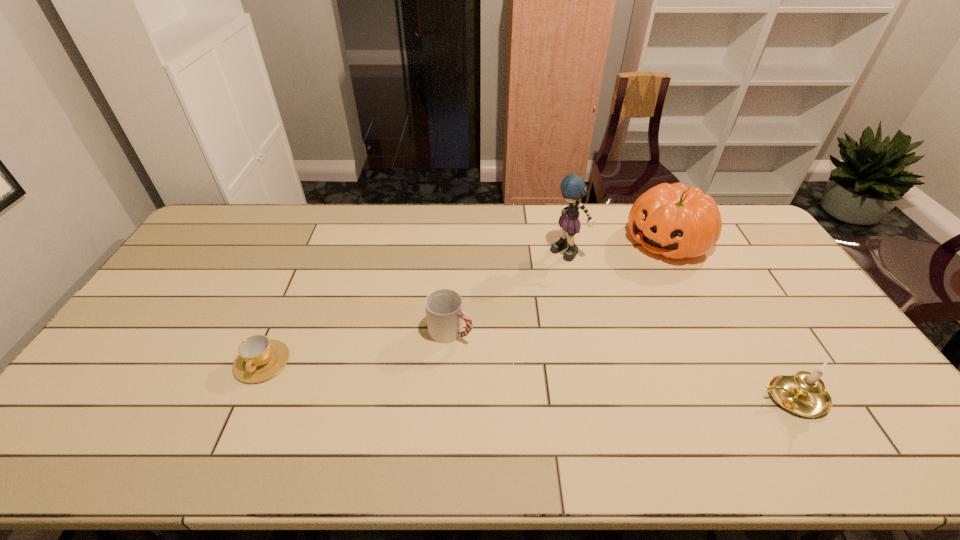
This screenshot has height=540, width=960. Find the location of `empty space that is in between the second tallest object and the third shortest object`. empty space that is in between the second tallest object and the third shortest object is located at coordinates (730, 319).

Locate which object is the third closest to the tallest object. Please provide its 2D coordinates. Your answer should be formatted as a tuple, i.e. [(x, y)], where the tuple contains the x and y coordinates of a point satisfying the conditions above.

[(804, 393)]

This screenshot has height=540, width=960. In order to click on object identified as the fourth closest to the candle holder in this screenshot , I will do `click(260, 358)`.

This screenshot has width=960, height=540. What are the coordinates of `free space that satisfies the following two spatial constraints: 1. on the front side of the second tallest object; 2. on the handle side of the third shortest object` in the screenshot? It's located at (745, 397).